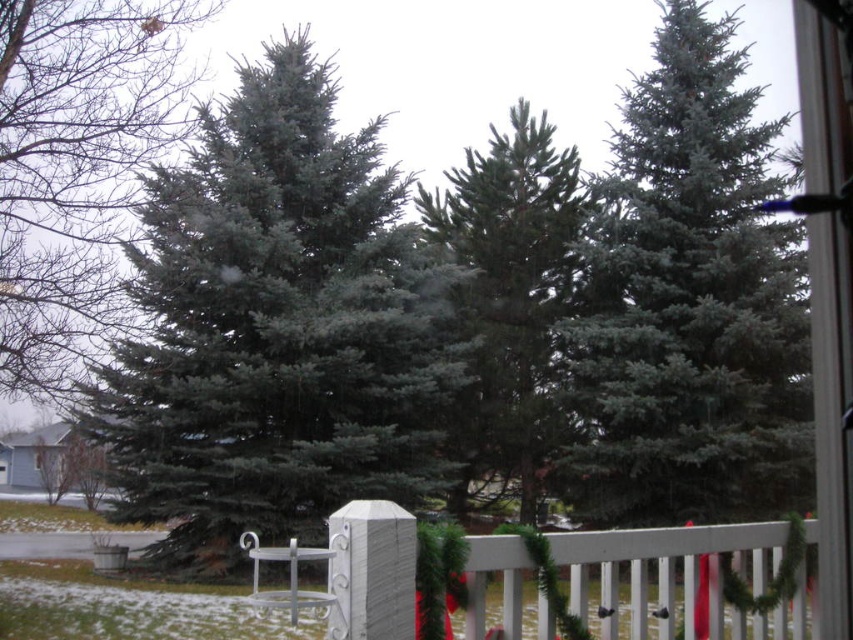
You are standing inside the house looking out the window. You see the green matte fir tree at left and the white wooden fence at lower center. Which object is closer to the window?

The white wooden fence at lower center is closer to the window because the green matte fir tree at left is positioned under it, meaning the fence is in front of the tree from the observer inside the house.

Based on the photo, you are standing inside the house looking out the window. You see the green matte fir tree at left and the white wooden fence at lower center. Which object is closer to the left edge of the window?

The green matte fir tree at left is closer to the left edge of the window because it is positioned to the left of the white wooden fence at lower center.

You are standing inside the house looking out the window. You see the green matte fir tree at left and the white wooden fence at lower center. Which object is closer to you?

The green matte fir tree at left is closer to you because it is further to the viewer than the white wooden fence at lower center.